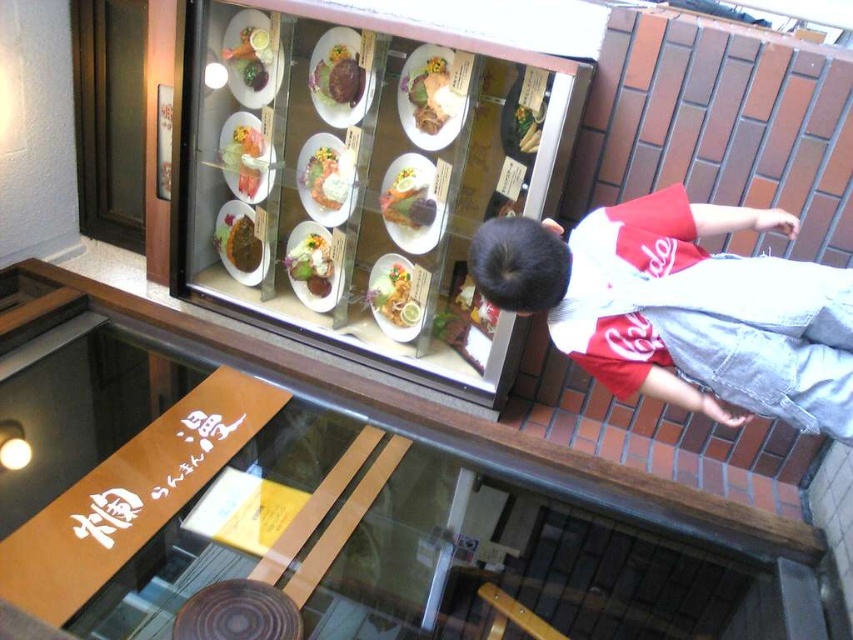
You are a customer at the restaurant and want to point out the brown wooden ledge at upper center and the smooth yellow rice at upper center to the server. Which one is located below the other?

The brown wooden ledge at upper center is positioned under the smooth yellow rice at upper center, meaning the ledge is below the rice.

You are a chef who wants to place a new garnish between the matte brown plate at center and the brown matte meat at center in the display case. If the garnish requires 1 inch of space, will there be enough room?

The distance between the matte brown plate at center and the brown matte meat at center is 0.64 inches, which is less than the required 1 inch. Therefore, there is not enough space to place the garnish between them.

You are a food critic standing in front of the display case and want to take a photo of the matte brown plate at center. Where should you position your camera to capture it?

The matte brown plate at center is located at coordinates point (242, 241), so position the camera to aim at that point to capture it.